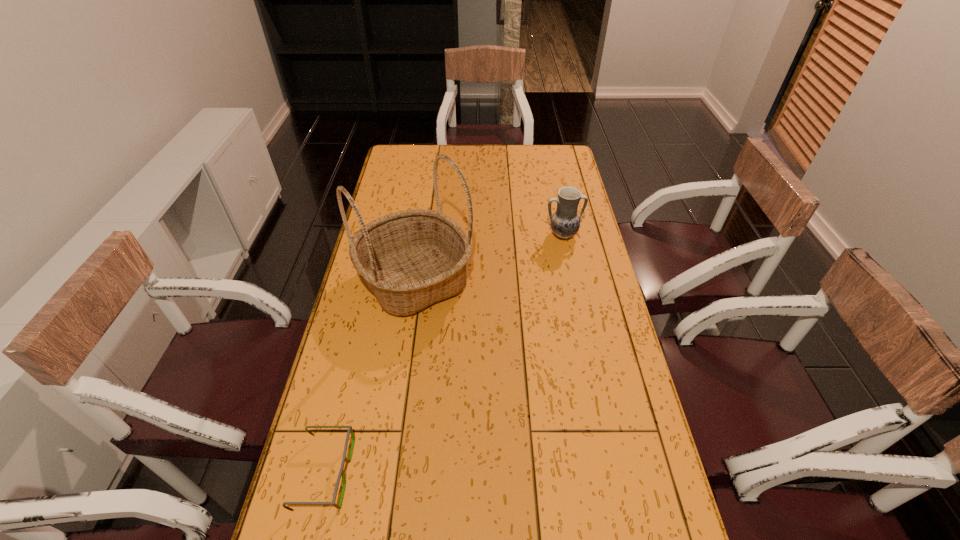
Find the location of `object at the right edge`. object at the right edge is located at coordinates (565, 222).

This screenshot has height=540, width=960. In the image, there is a desktop. Identify the location of vacant space at the far edge. (498, 150).

Locate an element on the screen. vacant space at the left edge of the desktop is located at coordinates (415, 172).

The height and width of the screenshot is (540, 960). In order to click on vacant space at the right edge of the desktop in this screenshot , I will do `click(602, 409)`.

In order to click on blank space at the far left corner of the desktop in this screenshot , I will do 403,169.

At what (x,y) coordinates should I click in order to perform the action: click on empty location between the tallest object and the spectacles. Please return your answer as a coordinate pair (x, y). This screenshot has height=540, width=960. Looking at the image, I should click on (371, 377).

Identify the location of free space between the shortest object and the second tallest object. (444, 354).

Where is `free point between the spectacles and the basket`? free point between the spectacles and the basket is located at coordinates (371, 377).

Find the location of a particular element. The image size is (960, 540). vacant space that is in between the second shortest object and the tallest object is located at coordinates (490, 258).

Find the location of a particular element. This screenshot has width=960, height=540. free area in between the second shortest object and the shortest object is located at coordinates (444, 354).